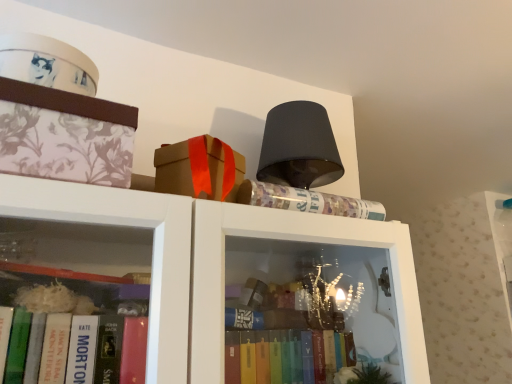
Where is `floral-patterned cardboard box at upper left`? The image size is (512, 384). floral-patterned cardboard box at upper left is located at coordinates point(65,135).

Measure the distance between floral-patterned cardboard box at upper left and camera.

floral-patterned cardboard box at upper left is 18.59 inches away from camera.

The width and height of the screenshot is (512, 384). Describe the element at coordinates (65, 135) in the screenshot. I see `floral-patterned cardboard box at upper left` at that location.

Identify the location of floral-patterned cardboard box at upper left. Image resolution: width=512 pixels, height=384 pixels. (65, 135).